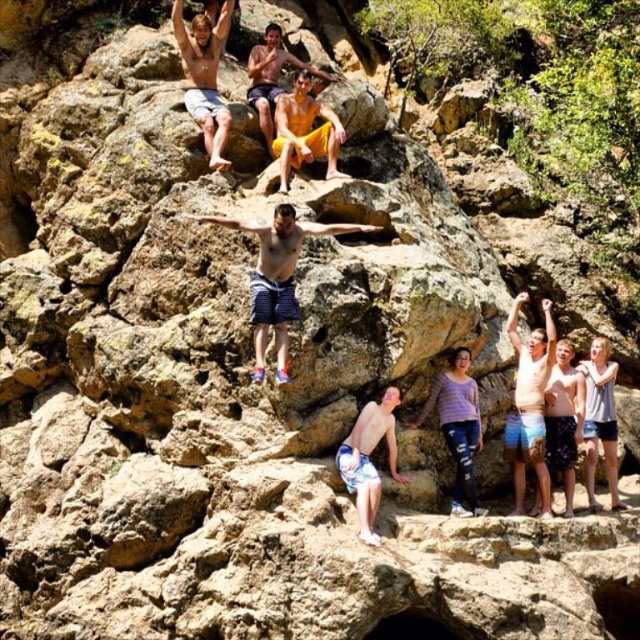
Question: Which object is positioned farthest from the striped shorts at center?

Choices:
 (A) yellow cotton shorts at center
 (B) matte skin at upper left

Answer: (B)

Question: Estimate the real-world distances between objects in this image. Which object is farther from the matte blue shorts at center?

Choices:
 (A) striped shorts at center
 (B) yellow cotton shorts at center
 (C) yellow shorts at upper center

Answer: (C)

Question: Does white striped shorts at center come in front of yellow cotton shorts at center?

Choices:
 (A) no
 (B) yes

Answer: (B)

Question: Which object appears closest to the camera in this image?

Choices:
 (A) white striped shorts at center
 (B) matte blue shorts at center
 (C) yellow shorts at upper center

Answer: (A)

Question: Is matte blue shorts at center wider than yellow shorts at upper center?

Choices:
 (A) yes
 (B) no

Answer: (A)

Question: Is matte blue shorts at center positioned behind matte skin at upper left?

Choices:
 (A) no
 (B) yes

Answer: (B)